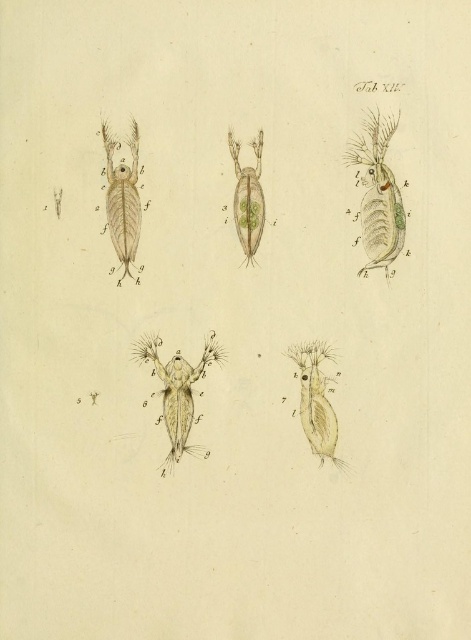
Question: Which object is the closest to the translucent green shrimp at upper right?

Choices:
 (A) translucent greenish-yellow at center
 (B) translucent greenish-yellow at upper left
 (C) translucent beige crustacean at lower right

Answer: (A)

Question: Considering the real-world distances, which object is closest to the translucent green shrimp at upper right?

Choices:
 (A) translucent beige crustacean at lower right
 (B) translucent beige crustacean at center
 (C) translucent greenish-yellow at upper left

Answer: (A)

Question: Can you confirm if translucent beige crustacean at lower right is thinner than translucent greenish-yellow at center?

Choices:
 (A) no
 (B) yes

Answer: (A)

Question: Can you confirm if translucent beige crustacean at center is smaller than translucent beige crustacean at lower right?

Choices:
 (A) no
 (B) yes

Answer: (A)

Question: Can you confirm if translucent beige crustacean at lower right is bigger than translucent greenish-yellow at center?

Choices:
 (A) no
 (B) yes

Answer: (B)

Question: Which of these objects is positioned farthest from the translucent beige crustacean at center?

Choices:
 (A) translucent greenish-yellow at center
 (B) translucent greenish-yellow at upper left
 (C) translucent green shrimp at upper right
 (D) translucent beige crustacean at lower right

Answer: (C)